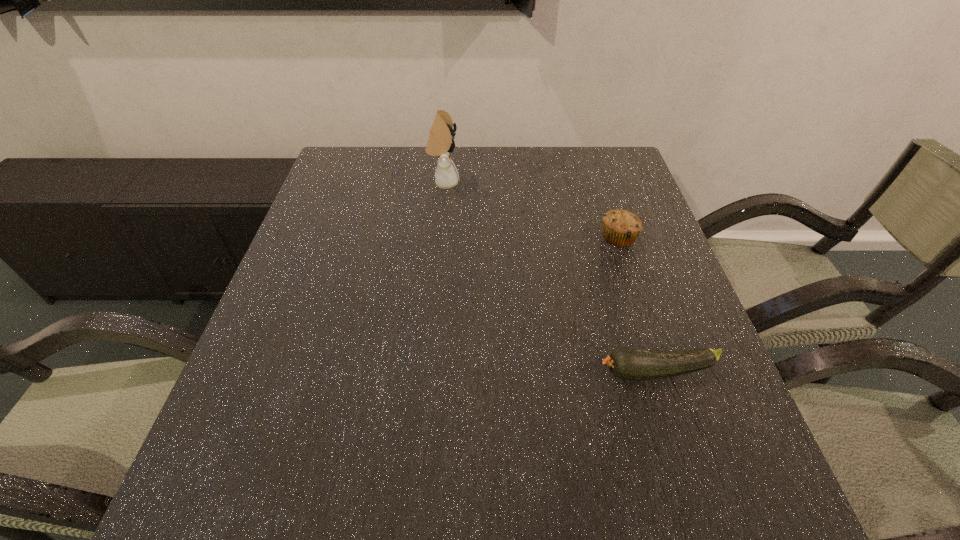
This screenshot has height=540, width=960. In order to click on the leftmost object in this screenshot , I will do `click(440, 143)`.

The width and height of the screenshot is (960, 540). Identify the location of the tallest object. (440, 143).

Find the location of `the second shortest object`. the second shortest object is located at coordinates (621, 228).

This screenshot has height=540, width=960. I want to click on the second farthest object, so click(x=621, y=228).

I want to click on the nearest object, so click(626, 363).

Locate an element on the screen. This screenshot has width=960, height=540. zucchini is located at coordinates (626, 363).

Find the location of a particular element. The height and width of the screenshot is (540, 960). vacant space positioned 0.290m at the front face of the tallest object is located at coordinates (559, 183).

Identify the location of blank space located 0.350m on the back of the muffin. (591, 155).

Where is `free space located at the blossom end of the shortest object`? free space located at the blossom end of the shortest object is located at coordinates (517, 372).

Where is `free space located 0.200m at the blossom end of the shortest object`? free space located 0.200m at the blossom end of the shortest object is located at coordinates (492, 372).